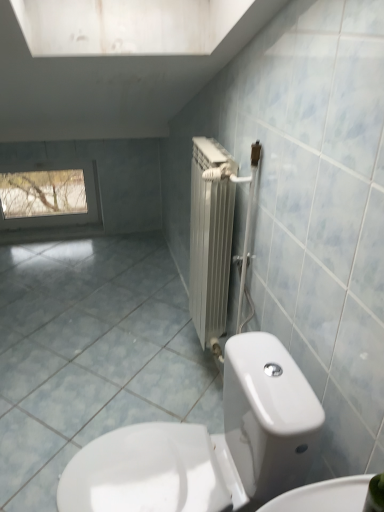
Question: Are clear glass window at upper left and white glossy toilet at lower center far apart?

Choices:
 (A) yes
 (B) no

Answer: (A)

Question: Is clear glass window at upper left positioned behind white glossy toilet at lower center?

Choices:
 (A) no
 (B) yes

Answer: (B)

Question: Is clear glass window at upper left smaller than white glossy toilet at lower center?

Choices:
 (A) no
 (B) yes

Answer: (B)

Question: Considering the relative positions of clear glass window at upper left and white glossy toilet at lower center in the image provided, is clear glass window at upper left to the left of white glossy toilet at lower center from the viewer's perspective?

Choices:
 (A) yes
 (B) no

Answer: (A)

Question: Is clear glass window at upper left closer to camera compared to white glossy toilet at lower center?

Choices:
 (A) no
 (B) yes

Answer: (A)

Question: From the image's perspective, is clear glass window at upper left on white glossy toilet at lower center?

Choices:
 (A) yes
 (B) no

Answer: (A)

Question: Is blue glossy tile at center positioned in front of clear glass window at upper left?

Choices:
 (A) no
 (B) yes

Answer: (B)

Question: Is blue glossy tile at center at the left side of clear glass window at upper left?

Choices:
 (A) no
 (B) yes

Answer: (A)

Question: Does blue glossy tile at center have a larger size compared to clear glass window at upper left?

Choices:
 (A) yes
 (B) no

Answer: (A)

Question: Is blue glossy tile at center turned away from clear glass window at upper left?

Choices:
 (A) yes
 (B) no

Answer: (B)

Question: Could you tell me if blue glossy tile at center is turned towards clear glass window at upper left?

Choices:
 (A) yes
 (B) no

Answer: (B)

Question: From the image's perspective, would you say blue glossy tile at center is shown under clear glass window at upper left?

Choices:
 (A) no
 (B) yes

Answer: (B)

Question: From the image's perspective, is white glossy toilet at lower center below clear glass window at upper left?

Choices:
 (A) no
 (B) yes

Answer: (B)